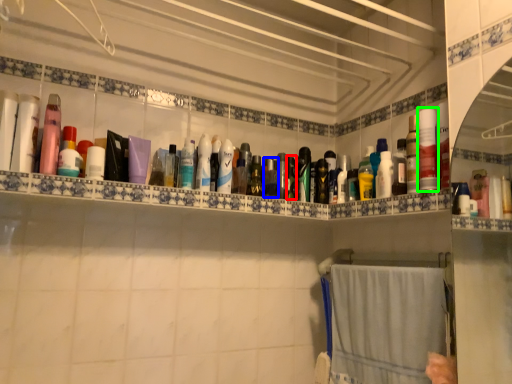
Question: Which object is the farthest from toiletry (highlighted by a red box)? Choose among these: toiletry (highlighted by a blue box) or toiletry (highlighted by a green box).

Choices:
 (A) toiletry
 (B) toiletry

Answer: (B)